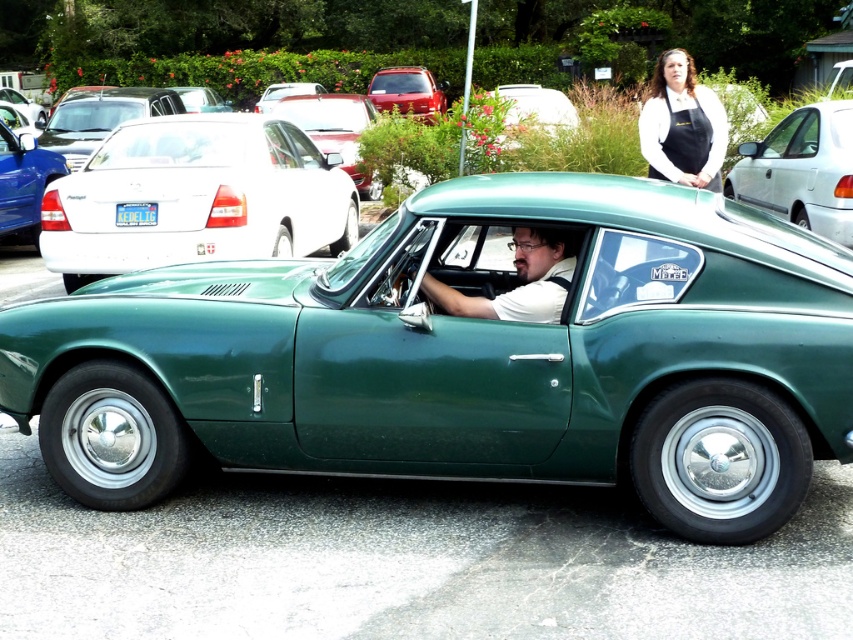
Consider the image. Who is more distant from viewer, [425,280] or [134,216]?

Point [134,216]

The image size is (853, 640). What do you see at coordinates (519, 278) in the screenshot?
I see `matte green car at center` at bounding box center [519, 278].

This screenshot has width=853, height=640. What do you see at coordinates (519, 278) in the screenshot?
I see `matte green car at center` at bounding box center [519, 278].

Locate an element on the screen. This screenshot has height=640, width=853. matte green car at center is located at coordinates (519, 278).

Is point (32, 237) positioned behind point (141, 224)?

That is True.

The height and width of the screenshot is (640, 853). Find the location of `matte green car at left`. matte green car at left is located at coordinates (22, 179).

Who is lower down, green metallic car at center or matte green car at left?

green metallic car at center is lower down.

Can you confirm if green metallic car at center is shorter than matte green car at left?

Incorrect, green metallic car at center's height does not fall short of matte green car at left's.

Does point (666, 468) lie in front of point (10, 148)?

Yes, point (666, 468) is in front of point (10, 148).

I want to click on green metallic car at center, so click(x=467, y=356).